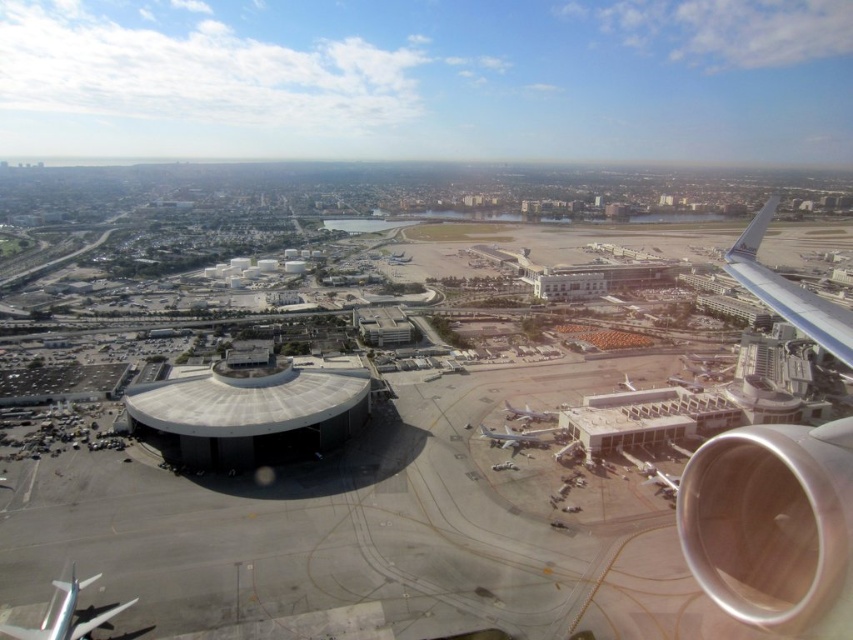
Question: Is smooth concrete tarmac at center below metallic silver airplane at center?

Choices:
 (A) no
 (B) yes

Answer: (A)

Question: Which of the following is the farthest from the observer?

Choices:
 (A) (717, 552)
 (B) (816, 330)

Answer: (B)

Question: Considering the real-world distances, which object is closest to the metallic silver airplane at center?

Choices:
 (A) silver metallic airplane at lower left
 (B) white matte airplane at center
 (C) silver metallic engine at right

Answer: (B)

Question: Can you confirm if metallic silver airplane at center is positioned to the right of white matte airplane at center?

Choices:
 (A) no
 (B) yes

Answer: (A)

Question: Which point is farther from the camera taking this photo?

Choices:
 (A) (54, 632)
 (B) (830, 307)
 (C) (524, 440)

Answer: (B)

Question: Does silver metallic engine at right appear on the left side of metallic silver airplane at center?

Choices:
 (A) yes
 (B) no

Answer: (B)